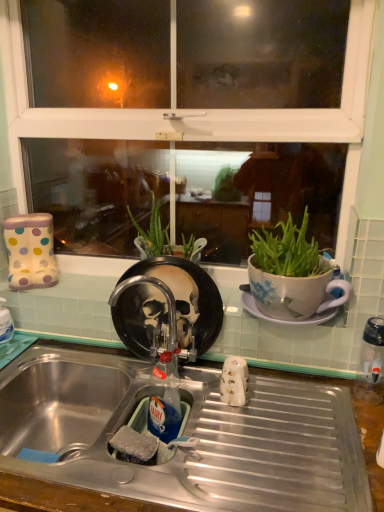
Image resolution: width=384 pixels, height=512 pixels. Identify the location of empty space that is to the right of rubber sponge at sink. (170, 437).